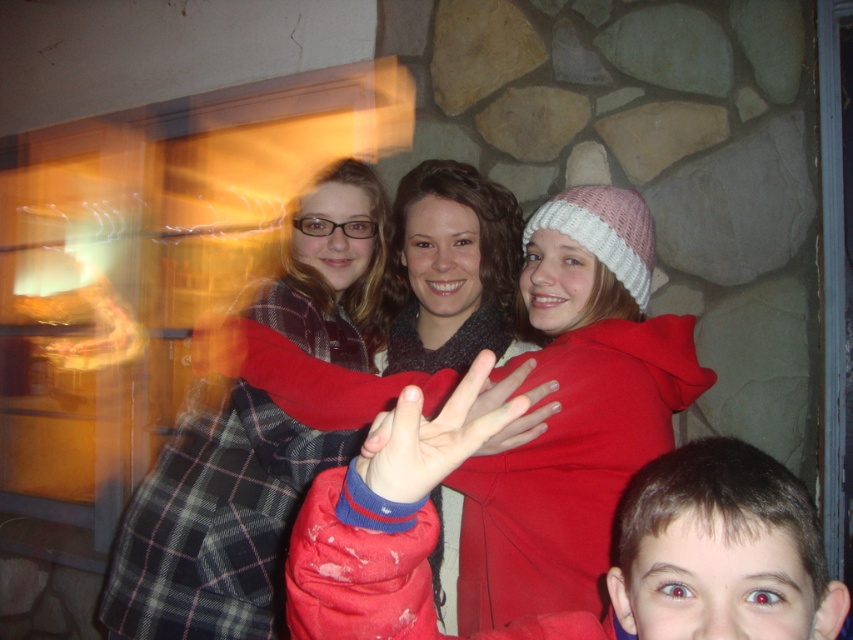
Question: Does matte red jacket at lower right appear over knitted woolen hat at center?

Choices:
 (A) no
 (B) yes

Answer: (A)

Question: Which object appears farthest from the camera in this image?

Choices:
 (A) knitted woolen hat at center
 (B) matte red jacket at lower right

Answer: (A)

Question: Is matte red jacket at lower right thinner than knitted woolen hat at center?

Choices:
 (A) yes
 (B) no

Answer: (A)

Question: Which point is closer to the camera?

Choices:
 (A) knitted woolen hat at center
 (B) matte red jacket at lower right

Answer: (B)

Question: Can you confirm if matte red jacket at lower right is wider than knitted woolen hat at center?

Choices:
 (A) no
 (B) yes

Answer: (A)